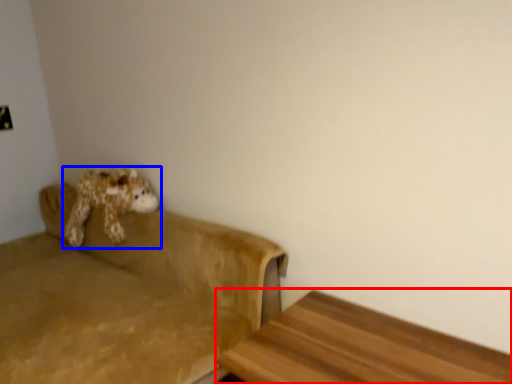
Question: Which object appears farthest to the camera in this image, furniture (highlighted by a red box) or toy (highlighted by a blue box)?

Choices:
 (A) furniture
 (B) toy

Answer: (B)